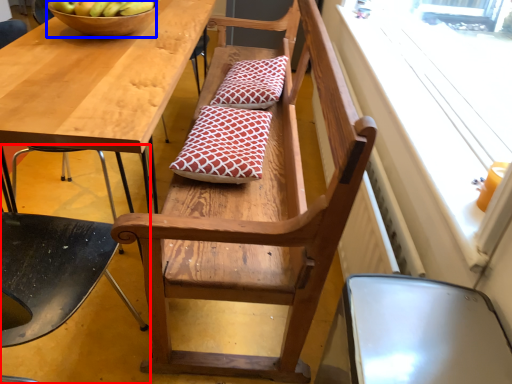
Question: Which of the following is the farthest to the observer, chair (highlighted by a red box) or bowl (highlighted by a blue box)?

Choices:
 (A) chair
 (B) bowl

Answer: (B)